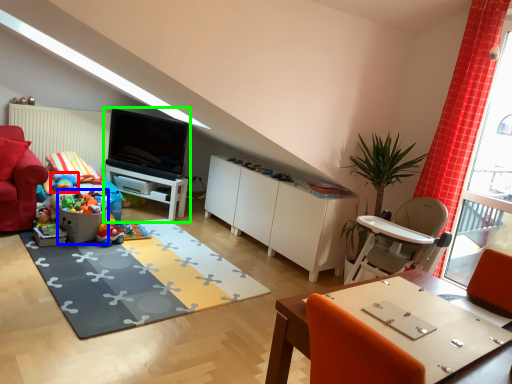
Question: Which object is the closest to the toy (highlighted by a red box)? Choose among these: toy (highlighted by a blue box) or entertainment center (highlighted by a green box).

Choices:
 (A) toy
 (B) entertainment center

Answer: (A)